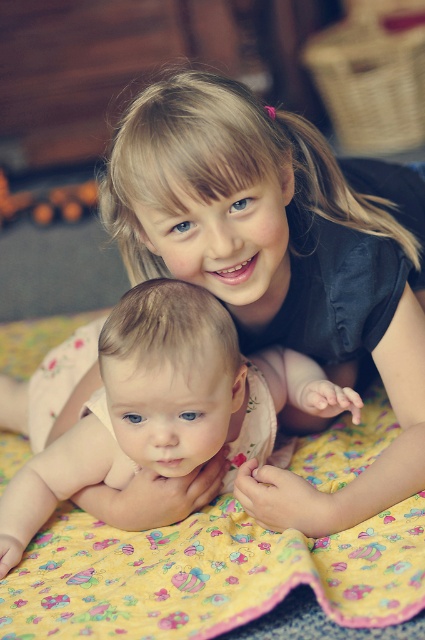
Between yellow floral fabric at center and smooth beige baby at center, which one appears on the right side from the viewer's perspective?

Positioned to the right is yellow floral fabric at center.

Is yellow floral fabric at center closer to the viewer compared to smooth beige baby at center?

Yes, it is in front of smooth beige baby at center.

Where is `yellow floral fabric at center`? The image size is (425, 640). yellow floral fabric at center is located at coordinates (207, 573).

I want to click on yellow floral fabric at center, so click(x=207, y=573).